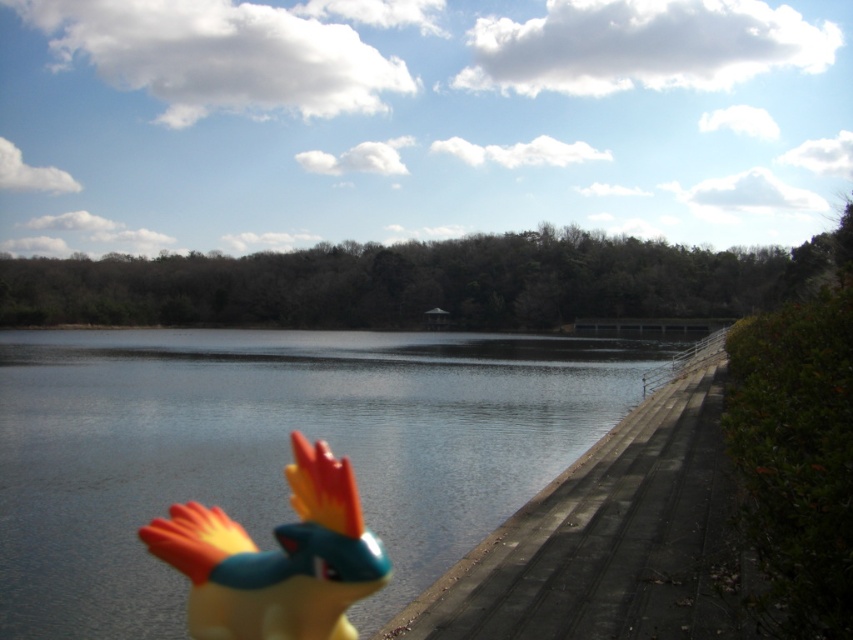
Does glossy water at lower left have a greater height compared to concrete at right?

Yes, glossy water at lower left is taller than concrete at right.

Between glossy water at lower left and concrete at right, which one has more height?

With more height is glossy water at lower left.

Who is more forward, (511,416) or (636,422)?

Positioned in front is point (636,422).

You are a GUI agent. You are given a task and a screenshot of the screen. Output one action in this format:
    pyautogui.click(x=<x>, y=<y>)
    Task: Click on the glossy water at lower left
    The height and width of the screenshot is (640, 853).
    Given the screenshot: What is the action you would take?
    pyautogui.click(x=274, y=449)

Between glossy water at lower left and shiny plastic bird at lower left, which one has less height?

With less height is shiny plastic bird at lower left.

Which is in front, point (35, 577) or point (344, 538)?

Point (344, 538)

Who is more forward, (x=364, y=332) or (x=183, y=536)?

Point (x=183, y=536)

The width and height of the screenshot is (853, 640). What are the coordinates of `glossy water at lower left` in the screenshot? It's located at (274, 449).

Can you confirm if concrete at right is positioned to the right of shiny plastic bird at lower left?

Correct, you'll find concrete at right to the right of shiny plastic bird at lower left.

Which is more to the left, concrete at right or shiny plastic bird at lower left?

Positioned to the left is shiny plastic bird at lower left.

What are the coordinates of `concrete at right` in the screenshot? It's located at (608, 532).